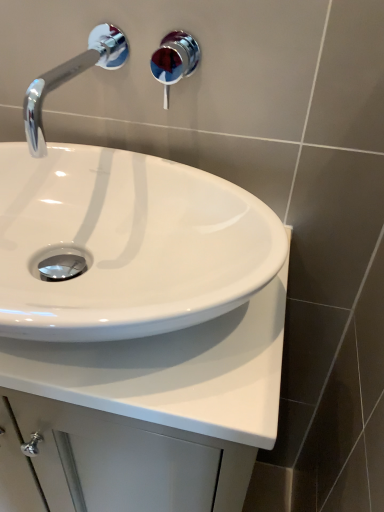
Identify the location of chrome/metallic faucet at upper left. The width and height of the screenshot is (384, 512). (71, 78).

Find the location of a particular element. The width and height of the screenshot is (384, 512). chrome/metallic faucet at upper left is located at coordinates (71, 78).

Considering the sizes of white glossy countertop at center and chrome/metallic faucet at upper left in the image, is white glossy countertop at center taller or shorter than chrome/metallic faucet at upper left?

In the image, white glossy countertop at center appears to be taller than chrome/metallic faucet at upper left.

Measure the distance from white glossy countertop at center to chrome/metallic faucet at upper left.

They are 15.87 inches apart.

Could chrome/metallic faucet at upper left be considered to be inside white glossy countertop at center?

That's incorrect, chrome/metallic faucet at upper left is not inside white glossy countertop at center.

From a real-world perspective, relative to chrome/metallic faucet at upper left, is white glossy countertop at center vertically above or below?

white glossy countertop at center is below chrome/metallic faucet at upper left.

Is white glossy countertop at center wider than shiny chrome shower at upper center?

Yes.

In the image, is white glossy countertop at center positioned in front of or behind shiny chrome shower at upper center?

Clearly, white glossy countertop at center is in front of shiny chrome shower at upper center.

Which object is positioned more to the right, white glossy countertop at center or shiny chrome shower at upper center?

shiny chrome shower at upper center is more to the right.

Is point (155, 74) positioned before point (104, 60)?

No, (155, 74) is further to viewer.

Looking at the image, does shiny chrome shower at upper center seem bigger or smaller compared to chrome/metallic faucet at upper left?

In the image, shiny chrome shower at upper center appears to be smaller than chrome/metallic faucet at upper left.

In order to click on tap above the shiny chrome shower at upper center (from a real-world perspective) in this screenshot , I will do `click(71, 78)`.

Is shiny chrome shower at upper center to the left of chrome/metallic faucet at upper left from the viewer's perspective?

Incorrect, shiny chrome shower at upper center is not on the left side of chrome/metallic faucet at upper left.

Is chrome/metallic faucet at upper left next to shiny chrome shower at upper center and touching it?

They are not placed beside each other.

Could you tell me if chrome/metallic faucet at upper left is facing shiny chrome shower at upper center?

No.

Can you tell me how much chrome/metallic faucet at upper left and shiny chrome shower at upper center differ in facing direction?

The facing directions of chrome/metallic faucet at upper left and shiny chrome shower at upper center are 0.00948 degrees apart.

Can you confirm if shiny chrome shower at upper center is positioned to the right of white glossy countertop at center?

Yes.

From the picture: Is shiny chrome shower at upper center facing away from white glossy countertop at center?

No, shiny chrome shower at upper center's orientation is not away from white glossy countertop at center.

Considering the sizes of objects shiny chrome shower at upper center and white glossy countertop at center in the image provided, who is smaller, shiny chrome shower at upper center or white glossy countertop at center?

shiny chrome shower at upper center is smaller.

Considering the sizes of shiny chrome shower at upper center and white glossy countertop at center in the image, is shiny chrome shower at upper center taller or shorter than white glossy countertop at center?

In the image, shiny chrome shower at upper center appears to be shorter than white glossy countertop at center.

The width and height of the screenshot is (384, 512). What are the coordinates of `tap on the left of white glossy countertop at center` in the screenshot? It's located at (71, 78).

From the image's perspective, relative to white glossy countertop at center, is chrome/metallic faucet at upper left above or below?

From the image's perspective, chrome/metallic faucet at upper left appears above white glossy countertop at center.

How different are the orientations of chrome/metallic faucet at upper left and white glossy countertop at center in degrees?

There is a 1.81-degree angle between the facing directions of chrome/metallic faucet at upper left and white glossy countertop at center.

Is chrome/metallic faucet at upper left closer to the viewer compared to white glossy countertop at center?

No.

Image resolution: width=384 pixels, height=512 pixels. I want to click on tap behind the white glossy countertop at center, so click(71, 78).

I want to click on counter top below the shiny chrome shower at upper center (from the image's perspective), so click(172, 372).

Which object lies nearer to the anchor point white glossy countertop at center, shiny chrome shower at upper center or chrome/metallic faucet at upper left?

chrome/metallic faucet at upper left.

Considering their positions, is chrome/metallic faucet at upper left positioned closer to shiny chrome shower at upper center than white glossy countertop at center?

The object closer to shiny chrome shower at upper center is chrome/metallic faucet at upper left.

Which object lies nearer to the anchor point white glossy countertop at center, chrome/metallic faucet at upper left or shiny chrome shower at upper center?

chrome/metallic faucet at upper left.

Which object lies nearer to the anchor point chrome/metallic faucet at upper left, white glossy countertop at center or shiny chrome shower at upper center?

Based on the image, white glossy countertop at center appears to be nearer to chrome/metallic faucet at upper left.

Estimate the real-world distances between objects in this image. Which object is closer to chrome/metallic faucet at upper left, shiny chrome shower at upper center or white glossy countertop at center?

Among the two, white glossy countertop at center is located nearer to chrome/metallic faucet at upper left.

Considering their positions, is white glossy countertop at center positioned further to shiny chrome shower at upper center than chrome/metallic faucet at upper left?

Among the two, white glossy countertop at center is located further to shiny chrome shower at upper center.

Image resolution: width=384 pixels, height=512 pixels. In order to click on tap between shiny chrome shower at upper center and white glossy countertop at center from top to bottom in this screenshot , I will do `click(71, 78)`.